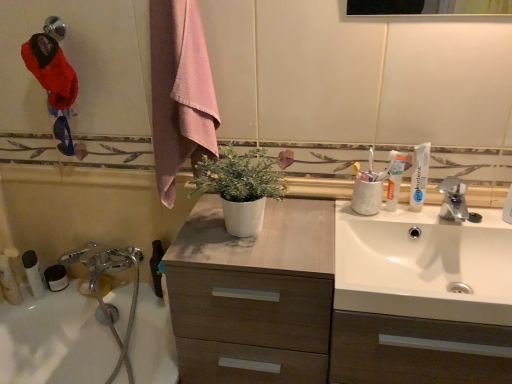
This screenshot has width=512, height=384. I want to click on free point above wooden cabinet at center (from a real-world perspective), so click(330, 234).